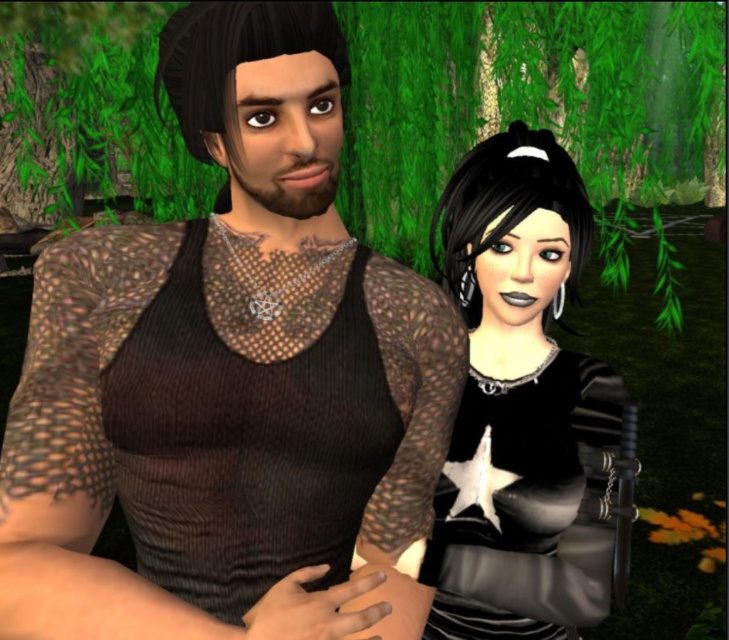
Who is positioned more to the left, matte black mesh tank top at center or black leather dress at right?

matte black mesh tank top at center

Does matte black mesh tank top at center have a lesser height compared to black leather dress at right?

Correct, matte black mesh tank top at center is not as tall as black leather dress at right.

Between point (268, 589) and point (467, 554), which one is positioned in front?

Positioned in front is point (268, 589).

This screenshot has height=640, width=729. Identify the location of matte black mesh tank top at center. (227, 376).